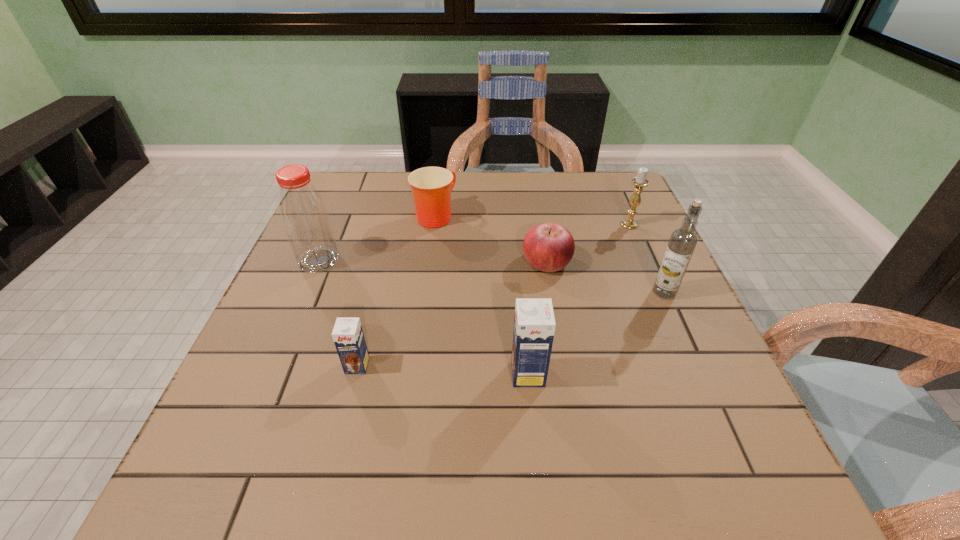
Identify the location of object located in the left edge section of the desktop. coord(303,211).

This screenshot has height=540, width=960. I want to click on candle holder that is at the right edge, so click(x=640, y=181).

The width and height of the screenshot is (960, 540). Find the location of `vodka that is at the right edge`. vodka that is at the right edge is located at coordinates (682, 242).

In the image, there is a desktop. Find the location of `vacant space at the far edge`. vacant space at the far edge is located at coordinates (477, 210).

Locate an element on the screen. Image resolution: width=960 pixels, height=540 pixels. blank area at the near edge is located at coordinates (481, 403).

Identify the location of vacant area at the left edge. Image resolution: width=960 pixels, height=540 pixels. (337, 279).

This screenshot has height=540, width=960. I want to click on free region at the right edge, so click(x=613, y=246).

The width and height of the screenshot is (960, 540). What are the coordinates of `vacant region at the far left corner of the desktop` in the screenshot? It's located at (360, 172).

The image size is (960, 540). I want to click on vacant region at the far right corner, so click(612, 177).

At what (x,y) coordinates should I click in order to perform the action: click on vacant space at the near right corner. Please return your answer as a coordinate pair (x, y). Looking at the image, I should click on (713, 433).